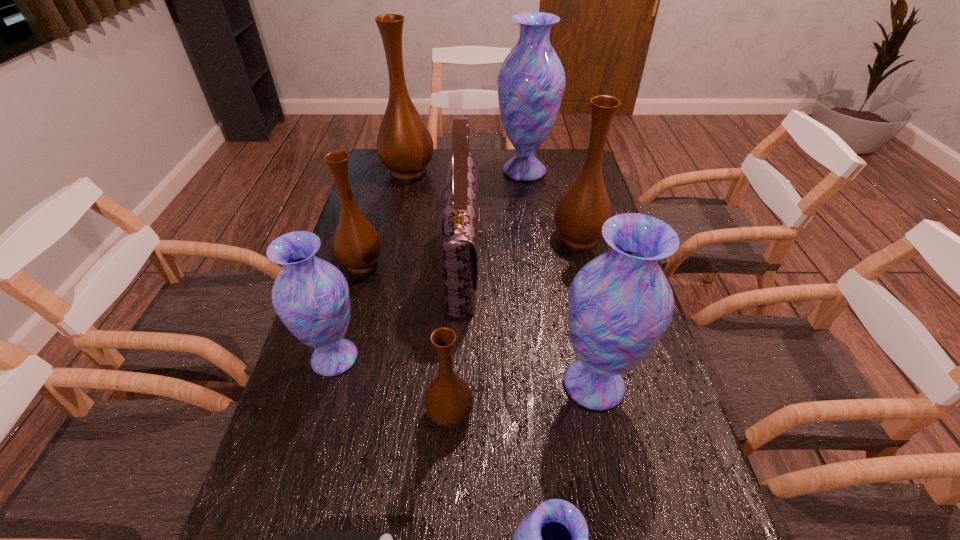
This screenshot has width=960, height=540. In order to click on vase that can be found as the third closest to the biggest purple vase in this screenshot , I will do click(357, 245).

Locate an element on the screen. the third closest purple vase relative to the fifth vase from right to left is located at coordinates (553, 539).

Identify which purple vase is the third nearest to the smallest purple vase. Please provide its 2D coordinates. Your answer should be formatted as a tuple, i.e. [(x, y)], where the tuple contains the x and y coordinates of a point satisfying the conditions above.

[(531, 81)]

Locate an element on the screen. brown vase that can be found as the third closest to the biggest purple vase is located at coordinates (357, 245).

Where is `brown vase object that ranks as the third closest to the handbag`? The image size is (960, 540). brown vase object that ranks as the third closest to the handbag is located at coordinates point(580,214).

In order to click on vacant space that satisfies the following two spatial constraints: 1. on the front of the handbag with the clasp; 2. on the right side of the second biggest purple vase in this screenshot , I will do `click(459, 384)`.